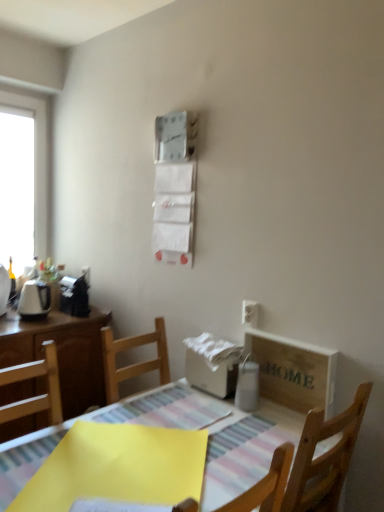
Question: Considering the positions of white glossy window at left and wooden crate at lower right in the image, is white glossy window at left wider or thinner than wooden crate at lower right?

Choices:
 (A) thin
 (B) wide

Answer: (B)

Question: Does point (0, 141) appear closer or farther from the camera than point (264, 388)?

Choices:
 (A) closer
 (B) farther

Answer: (B)

Question: Estimate the real-world distances between objects in this image. Which object is farther from the yellow paper at lower left?

Choices:
 (A) white glossy window at left
 (B) wooden table at center
 (C) wooden crate at lower right
 (D) white plastic electric outlet at upper right
 (E) white paper towel at center

Answer: (A)

Question: Which object is the farthest from the wooden crate at lower right?

Choices:
 (A) white paper towel at center
 (B) white plastic electric outlet at upper right
 (C) white glossy window at left
 (D) wooden table at center
 (E) yellow paper at lower left

Answer: (C)